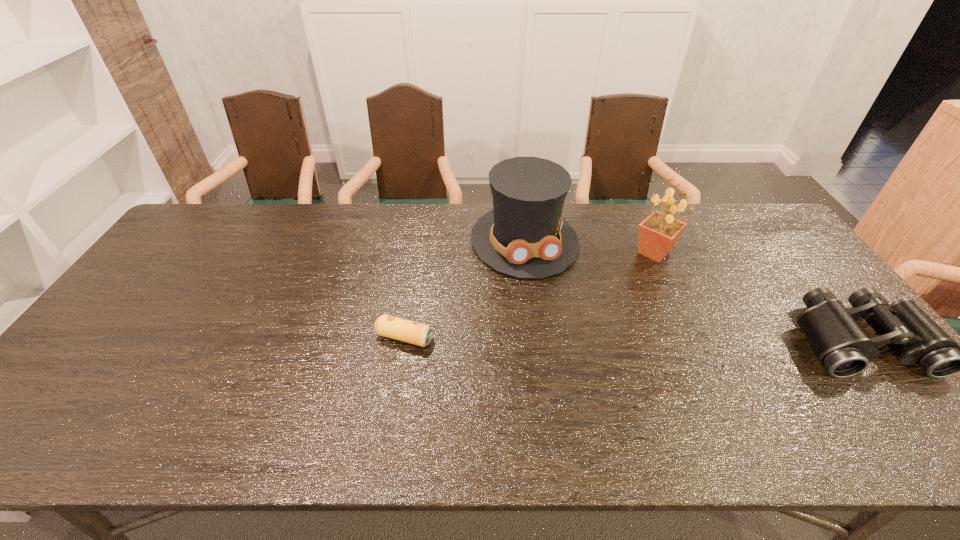
Locate an element on the screen. This screenshot has height=540, width=960. free space on the desktop that is between the leftmost object and the second shortest object and is positioned with goggles on the front of the dress hat is located at coordinates (567, 339).

I want to click on free space on the desktop that is between the shortest object and the binoculars and is positioned at the front of the sunflower with flowers visible, so click(698, 339).